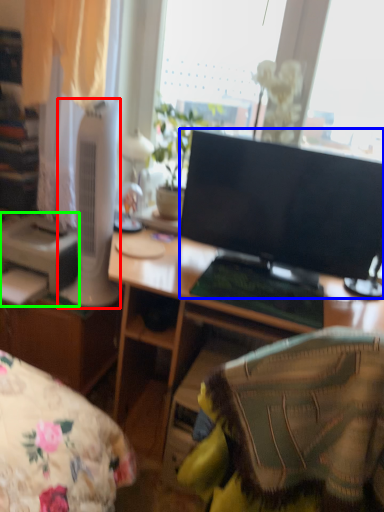
Question: Which is nearer to the home appliance (highlighted by a red box)? television (highlighted by a blue box) or printer (highlighted by a green box).

Choices:
 (A) television
 (B) printer

Answer: (B)